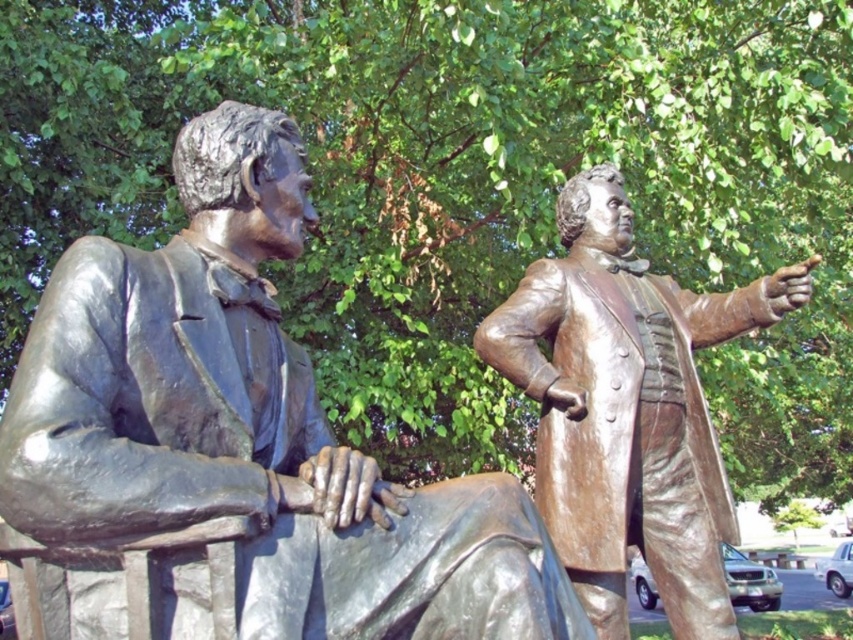
Is bronze statue at left to the left of bronze statue at right from the viewer's perspective?

Yes, bronze statue at left is to the left of bronze statue at right.

Is point (189, 490) closer to camera compared to point (616, 320)?

Yes, it is.

What do you see at coordinates (250, 426) in the screenshot? The width and height of the screenshot is (853, 640). I see `bronze statue at left` at bounding box center [250, 426].

Where is `bronze statue at left`? This screenshot has width=853, height=640. bronze statue at left is located at coordinates (250, 426).